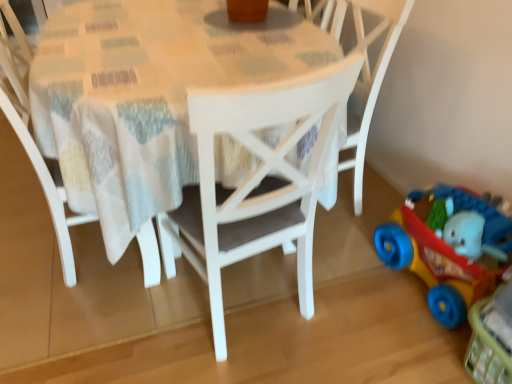
Question: From a real-world perspective, is white matte chair at center, which is the 1th chair from right to left, positioned above or below white matte chair at center, which ranks as the second chair in right-to-left order?

Choices:
 (A) above
 (B) below

Answer: (A)

Question: In the image, is white matte chair at center, positioned as the 2th chair in left-to-right order, on the left side or the right side of white matte chair at center, arranged as the first chair when viewed from the left?

Choices:
 (A) left
 (B) right

Answer: (B)

Question: Which object is the closest to the white matte chair at center, which is the 1th chair from right to left?

Choices:
 (A) white painted wood table at center
 (B) white matte chair at center, which ranks as the second chair in right-to-left order
 (C) rubberized plastic toy car at lower right

Answer: (C)

Question: Considering the real-world distances, which object is farthest from the white matte chair at center, which is the 1th chair from right to left?

Choices:
 (A) rubberized plastic toy car at lower right
 (B) white matte chair at center, which ranks as the second chair in right-to-left order
 (C) white painted wood table at center

Answer: (B)